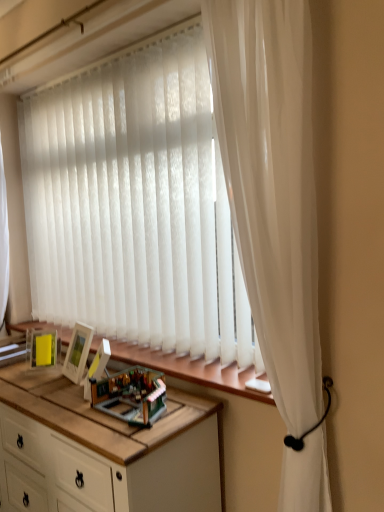
Where is `vacant space to the right of translucent plastic toy at center`? The image size is (384, 512). vacant space to the right of translucent plastic toy at center is located at coordinates (187, 403).